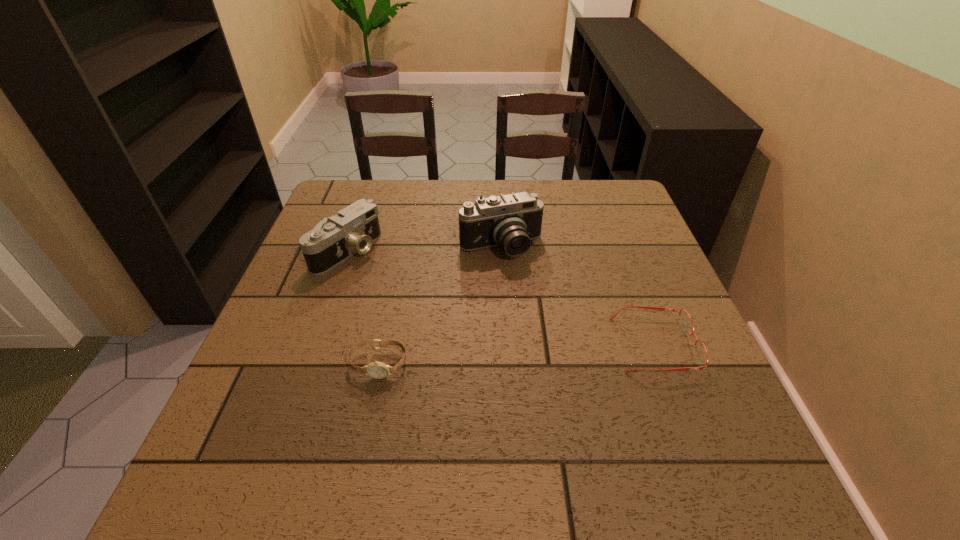
I want to click on vacant space located on the lens of the left camera, so click(485, 332).

I want to click on free space located on the front-facing side of the right camera, so click(566, 359).

Where is `vacant space located 0.220m on the front-facing side of the right camera`? vacant space located 0.220m on the front-facing side of the right camera is located at coordinates (550, 330).

Image resolution: width=960 pixels, height=540 pixels. In order to click on vacant region located 0.290m on the front-facing side of the right camera in this screenshot , I will do `click(564, 355)`.

The width and height of the screenshot is (960, 540). I want to click on object that is at the left edge, so click(x=353, y=230).

Where is `object that is at the right edge`? object that is at the right edge is located at coordinates (686, 323).

Where is `vacant space at the far edge of the desktop`? The width and height of the screenshot is (960, 540). vacant space at the far edge of the desktop is located at coordinates (503, 191).

In the image, there is a desktop. Identify the location of vacant space at the near edge. (340, 413).

Identify the location of vacant space at the left edge of the desktop. Image resolution: width=960 pixels, height=540 pixels. (347, 295).

What are the coordinates of `free point at the right edge` in the screenshot? It's located at (628, 268).